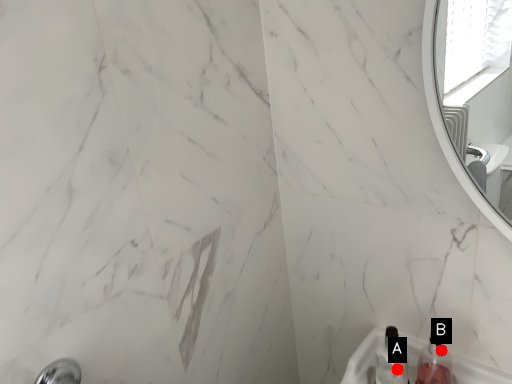
Question: Two points are circled on the image, labeled by A and B beside each circle. Which of the following is the farthest from the observer?

Choices:
 (A) A is further
 (B) B is further

Answer: (A)